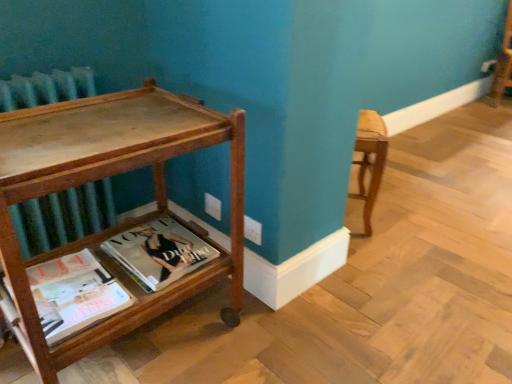
Locate an element on the screen. Image resolution: width=512 pixels, height=384 pixels. matte paper magazine at lower left, the first book when ordered from front to back is located at coordinates (74, 294).

Considering the relative positions of matte paper magazine at lower left, the second book from the back, and wooden table at left in the image provided, is matte paper magazine at lower left, the second book from the back, to the right of wooden table at left from the viewer's perspective?

No.

Measure the distance from matte paper magazine at lower left, the first book when ordered from front to back, to wooden table at left.

8.75 inches.

Is matte paper magazine at lower left, the first book when ordered from front to back, in contact with matte hardcover book at lower center, which ranks as the first book in back-to-front order?

They are not placed beside each other.

Is point (6, 295) in front of point (146, 240)?

That is True.

Consider the image. Considering the relative sizes of matte paper magazine at lower left, the first book when ordered from front to back, and matte hardcover book at lower center, the 2th book in the front-to-back sequence, in the image provided, is matte paper magazine at lower left, the first book when ordered from front to back, wider than matte hardcover book at lower center, the 2th book in the front-to-back sequence,?

Yes.

Is point (162, 223) closer to viewer compared to point (95, 304)?

No, (162, 223) is behind (95, 304).

Identify the location of book in front of the matte hardcover book at lower center, which ranks as the first book in back-to-front order. This screenshot has height=384, width=512. (74, 294).

Considering the relative sizes of matte hardcover book at lower center, which ranks as the first book in back-to-front order, and matte paper magazine at lower left, the first book when ordered from front to back, in the image provided, is matte hardcover book at lower center, which ranks as the first book in back-to-front order, bigger than matte paper magazine at lower left, the first book when ordered from front to back,?

Yes.

From a real-world perspective, relative to matte paper magazine at lower left, the first book when ordered from front to back, is matte hardcover book at lower center, the 2th book in the front-to-back sequence, vertically above or below?

From a real-world perspective, matte hardcover book at lower center, the 2th book in the front-to-back sequence, is physically below matte paper magazine at lower left, the first book when ordered from front to back.

Considering their positions, is matte hardcover book at lower center, the 2th book in the front-to-back sequence, located in front of or behind wooden table at left?

Visually, matte hardcover book at lower center, the 2th book in the front-to-back sequence, is located behind wooden table at left.

From the image's perspective, is matte hardcover book at lower center, the 2th book in the front-to-back sequence, above wooden table at left?

No, from the image's perspective, matte hardcover book at lower center, the 2th book in the front-to-back sequence, is not over wooden table at left.

Can you confirm if matte hardcover book at lower center, which ranks as the first book in back-to-front order, is taller than wooden table at left?

No.

In the scene shown: Is matte hardcover book at lower center, which ranks as the first book in back-to-front order, beside wooden table at left?

No, matte hardcover book at lower center, which ranks as the first book in back-to-front order, is not beside wooden table at left.

Which point is more forward, (144, 127) or (174, 240)?

Point (144, 127)

Identify the location of table located above the matte hardcover book at lower center, which ranks as the first book in back-to-front order (from the image's perspective). (102, 178).

Which of these two, wooden table at left or matte hardcover book at lower center, which ranks as the first book in back-to-front order, stands shorter?

matte hardcover book at lower center, which ranks as the first book in back-to-front order.

Considering the positions of objects wooden table at left and matte hardcover book at lower center, the 2th book in the front-to-back sequence, in the image provided, who is more to the left, wooden table at left or matte hardcover book at lower center, the 2th book in the front-to-back sequence,?

wooden table at left is more to the left.

Does wooden table at left turn towards matte paper magazine at lower left, the first book when ordered from front to back?

Yes, wooden table at left faces towards matte paper magazine at lower left, the first book when ordered from front to back.

This screenshot has height=384, width=512. In the image, there is a matte paper magazine at lower left, the second book from the back. In order to click on table above it (from the image's perspective) in this screenshot , I will do `click(102, 178)`.

Between wooden table at left and matte paper magazine at lower left, the first book when ordered from front to back, which one appears on the left side from the viewer's perspective?

Positioned to the left is matte paper magazine at lower left, the first book when ordered from front to back.

At what (x,y) coordinates should I click in order to perform the action: click on the 1st book behind the wooden table at left, starting your count from the anchor. Please return your answer as a coordinate pair (x, y). Image resolution: width=512 pixels, height=384 pixels. Looking at the image, I should click on (74, 294).

Identify the location of book lying above the matte paper magazine at lower left, the second book from the back (from the image's perspective). The image size is (512, 384). (159, 252).

Based on the photo, based on their spatial positions, is matte hardcover book at lower center, which ranks as the first book in back-to-front order, or matte paper magazine at lower left, the first book when ordered from front to back, further from wooden table at left?

Based on the image, matte paper magazine at lower left, the first book when ordered from front to back, appears to be further to wooden table at left.

Based on their spatial positions, is wooden table at left or matte hardcover book at lower center, which ranks as the first book in back-to-front order, closer to matte paper magazine at lower left, the first book when ordered from front to back?

matte hardcover book at lower center, which ranks as the first book in back-to-front order, is closer to matte paper magazine at lower left, the first book when ordered from front to back.

Which object lies nearer to the anchor point matte hardcover book at lower center, which ranks as the first book in back-to-front order, matte paper magazine at lower left, the first book when ordered from front to back, or wooden table at left?

matte paper magazine at lower left, the first book when ordered from front to back, is positioned closer to the anchor matte hardcover book at lower center, which ranks as the first book in back-to-front order.

Looking at the image, which one is located closer to wooden table at left, matte paper magazine at lower left, the second book from the back, or matte hardcover book at lower center, the 2th book in the front-to-back sequence?

matte hardcover book at lower center, the 2th book in the front-to-back sequence.

From the image, which object appears to be nearer to matte paper magazine at lower left, the first book when ordered from front to back, matte hardcover book at lower center, the 2th book in the front-to-back sequence, or wooden table at left?

matte hardcover book at lower center, the 2th book in the front-to-back sequence, is closer to matte paper magazine at lower left, the first book when ordered from front to back.

Based on their spatial positions, is wooden table at left or matte paper magazine at lower left, the first book when ordered from front to back, closer to matte hardcover book at lower center, the 2th book in the front-to-back sequence?

Among the two, matte paper magazine at lower left, the first book when ordered from front to back, is located nearer to matte hardcover book at lower center, the 2th book in the front-to-back sequence.

This screenshot has height=384, width=512. What are the coordinates of `book located between wooden table at left and matte hardcover book at lower center, which ranks as the first book in back-to-front order, in the depth direction` in the screenshot? It's located at (74, 294).